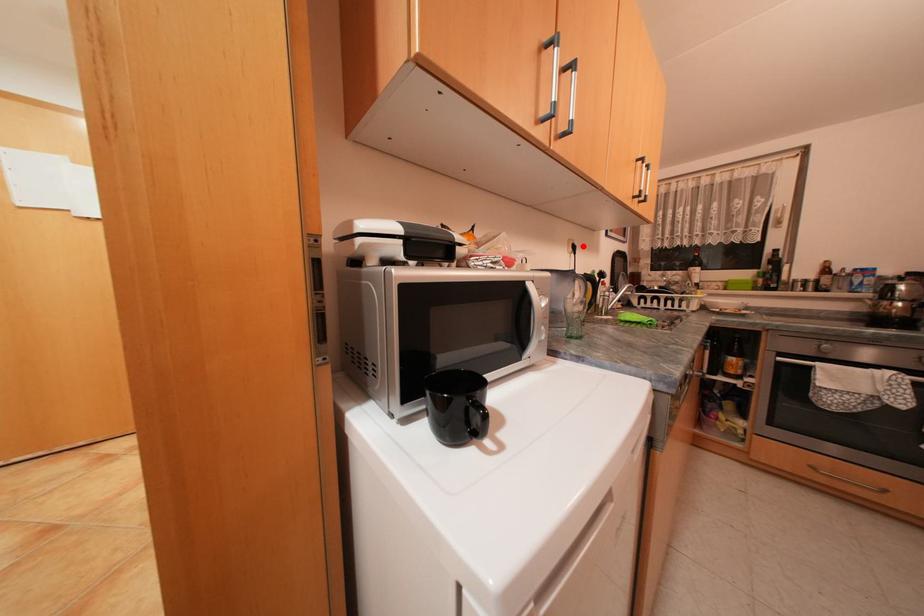
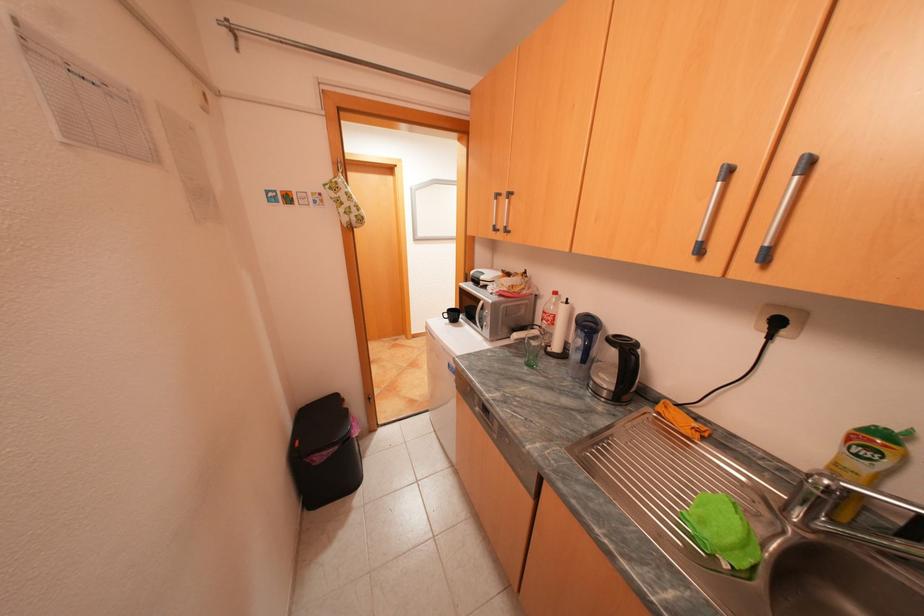
Find the pixel in the second image that matches the highlighted location in the first image.

(786, 323)